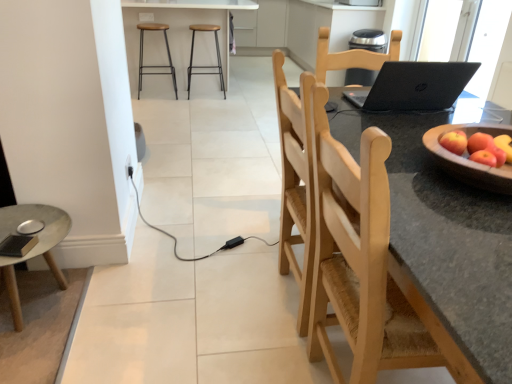
Find the location of a particular element. The width and height of the screenshot is (512, 384). vacant space in front of red matte apple at right is located at coordinates (473, 200).